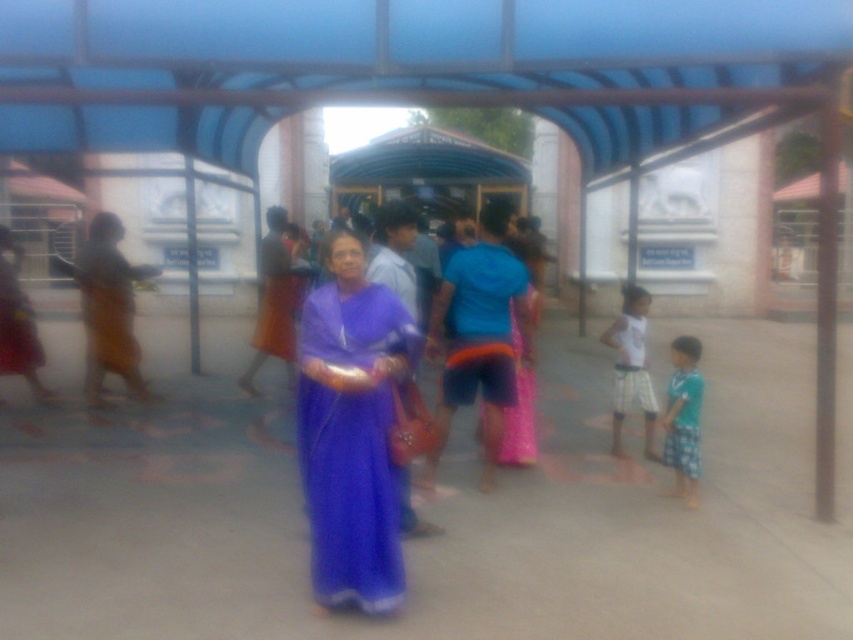
Can you confirm if matte purple dress at center is smaller than white cotton shirt at center?

No, matte purple dress at center is not smaller than white cotton shirt at center.

Consider the image. Does matte purple dress at center appear over white cotton shirt at center?

Correct, matte purple dress at center is located above white cotton shirt at center.

Identify the location of matte purple dress at center. (273, 300).

The image size is (853, 640). What are the coordinates of `matte purple dress at center` in the screenshot? It's located at (273, 300).

Does point (328, 301) lie behind point (689, 456)?

No, (328, 301) is in front of (689, 456).

Does matte purple sari at center have a lesser height compared to green plaid shorts at lower right?

No, matte purple sari at center is not shorter than green plaid shorts at lower right.

Is point (379, 516) positioned behind point (666, 465)?

No, it is in front of (666, 465).

Locate an element on the screen. This screenshot has width=853, height=640. matte purple sari at center is located at coordinates (351, 429).

This screenshot has height=640, width=853. What do you see at coordinates (631, 368) in the screenshot?
I see `white cotton shirt at center` at bounding box center [631, 368].

Between white cotton shirt at center and green plaid shorts at lower right, which one has more height?

white cotton shirt at center is taller.

Who is more forward, (643, 337) or (697, 403)?

Point (697, 403) is more forward.

Image resolution: width=853 pixels, height=640 pixels. In order to click on white cotton shirt at center in this screenshot , I will do `click(631, 368)`.